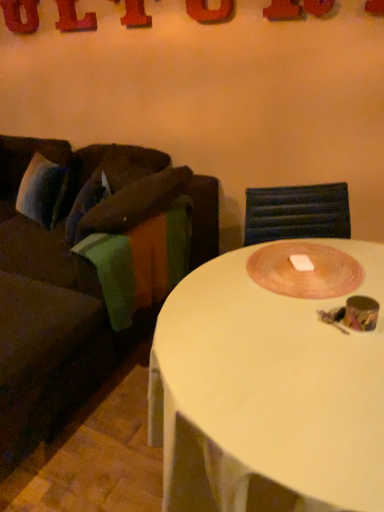
Question: Considering the relative sizes of white plastic coffee table at center and wooden placemat at center in the image provided, is white plastic coffee table at center wider than wooden placemat at center?

Choices:
 (A) no
 (B) yes

Answer: (B)

Question: Is white plastic coffee table at center touching wooden placemat at center?

Choices:
 (A) yes
 (B) no

Answer: (B)

Question: Considering the relative sizes of white plastic coffee table at center and wooden placemat at center in the image provided, is white plastic coffee table at center taller than wooden placemat at center?

Choices:
 (A) yes
 (B) no

Answer: (A)

Question: Does white plastic coffee table at center have a lesser height compared to wooden placemat at center?

Choices:
 (A) yes
 (B) no

Answer: (B)

Question: Is the position of white plastic coffee table at center more distant than that of wooden placemat at center?

Choices:
 (A) no
 (B) yes

Answer: (A)

Question: Is white plastic coffee table at center thinner than wooden placemat at center?

Choices:
 (A) no
 (B) yes

Answer: (A)

Question: Is green fabric blanket at left oriented towards wooden placemat at center?

Choices:
 (A) no
 (B) yes

Answer: (A)

Question: Is green fabric blanket at left positioned behind wooden placemat at center?

Choices:
 (A) yes
 (B) no

Answer: (A)

Question: Is green fabric blanket at left touching wooden placemat at center?

Choices:
 (A) no
 (B) yes

Answer: (A)

Question: From a real-world perspective, is green fabric blanket at left located higher than wooden placemat at center?

Choices:
 (A) yes
 (B) no

Answer: (B)

Question: Is green fabric blanket at left positioned in front of wooden placemat at center?

Choices:
 (A) no
 (B) yes

Answer: (A)

Question: Does green fabric blanket at left have a lesser height compared to wooden placemat at center?

Choices:
 (A) yes
 (B) no

Answer: (B)

Question: Is white plastic coffee table at center closer to camera compared to red plastic letter l at upper left, which ranks as the fourth letter in front-to-back order?

Choices:
 (A) no
 (B) yes

Answer: (B)